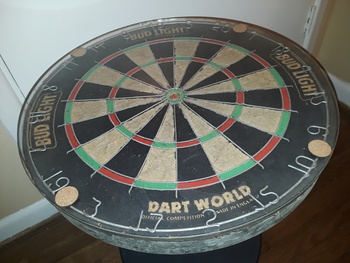
I want to click on baseboard, so click(18, 230).